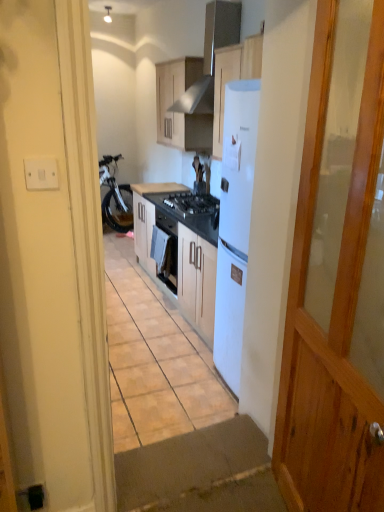
Question: From the image's perspective, would you say white plastic switch at left is shown under black matte gas stove at center?

Choices:
 (A) yes
 (B) no

Answer: (A)

Question: Is white plastic switch at left smaller than black matte gas stove at center?

Choices:
 (A) yes
 (B) no

Answer: (A)

Question: Does white plastic switch at left lie behind black matte gas stove at center?

Choices:
 (A) yes
 (B) no

Answer: (B)

Question: From a real-world perspective, is white plastic switch at left positioned under black matte gas stove at center based on gravity?

Choices:
 (A) yes
 (B) no

Answer: (B)

Question: From a real-world perspective, is white plastic switch at left on black matte gas stove at center?

Choices:
 (A) yes
 (B) no

Answer: (A)

Question: Is white glossy refrigerator at upper center taller or shorter than white plastic switch at left?

Choices:
 (A) tall
 (B) short

Answer: (A)

Question: Choose the correct answer: Is white glossy refrigerator at upper center inside white plastic switch at left or outside it?

Choices:
 (A) outside
 (B) inside

Answer: (A)

Question: From the image's perspective, relative to white plastic switch at left, is white glossy refrigerator at upper center above or below?

Choices:
 (A) above
 (B) below

Answer: (A)

Question: Considering the positions of white glossy refrigerator at upper center and white plastic switch at left in the image, is white glossy refrigerator at upper center bigger or smaller than white plastic switch at left?

Choices:
 (A) small
 (B) big

Answer: (B)

Question: In terms of width, does white plastic switch at left look wider or thinner when compared to white glossy refrigerator at upper center?

Choices:
 (A) wide
 (B) thin

Answer: (B)

Question: Considering the positions of white plastic switch at left and white glossy refrigerator at upper center in the image, is white plastic switch at left taller or shorter than white glossy refrigerator at upper center?

Choices:
 (A) tall
 (B) short

Answer: (B)

Question: From a real-world perspective, is white plastic switch at left physically located above or below white glossy refrigerator at upper center?

Choices:
 (A) above
 (B) below

Answer: (B)

Question: In the image, is white plastic switch at left on the left side or the right side of white glossy refrigerator at upper center?

Choices:
 (A) right
 (B) left

Answer: (B)

Question: In terms of height, does white glossy refrigerator at upper center look taller or shorter compared to matte wood cabinet at upper center, which is counted as the 2th cabinetry, starting from the bottom?

Choices:
 (A) tall
 (B) short

Answer: (A)

Question: Does point [233, 35] appear closer or farther from the camera than point [170, 138]?

Choices:
 (A) farther
 (B) closer

Answer: (B)